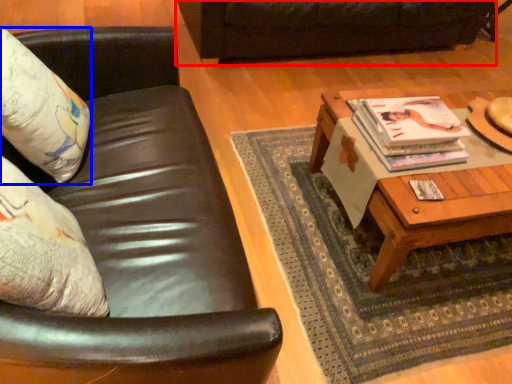
Question: Which of the following is the closest to the observer, studio couch (highlighted by a red box) or pillow (highlighted by a blue box)?

Choices:
 (A) studio couch
 (B) pillow

Answer: (B)